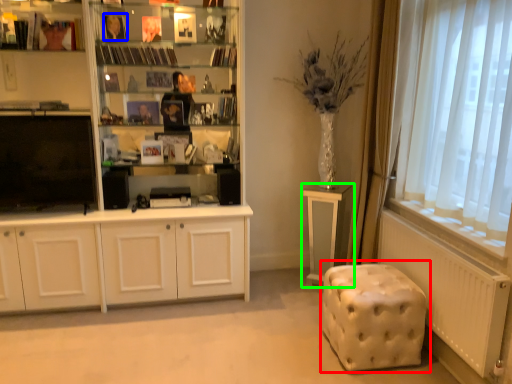
Question: Which is nearer to the music stool (highlighted by a red box)? book (highlighted by a blue box) or table (highlighted by a green box).

Choices:
 (A) book
 (B) table

Answer: (B)